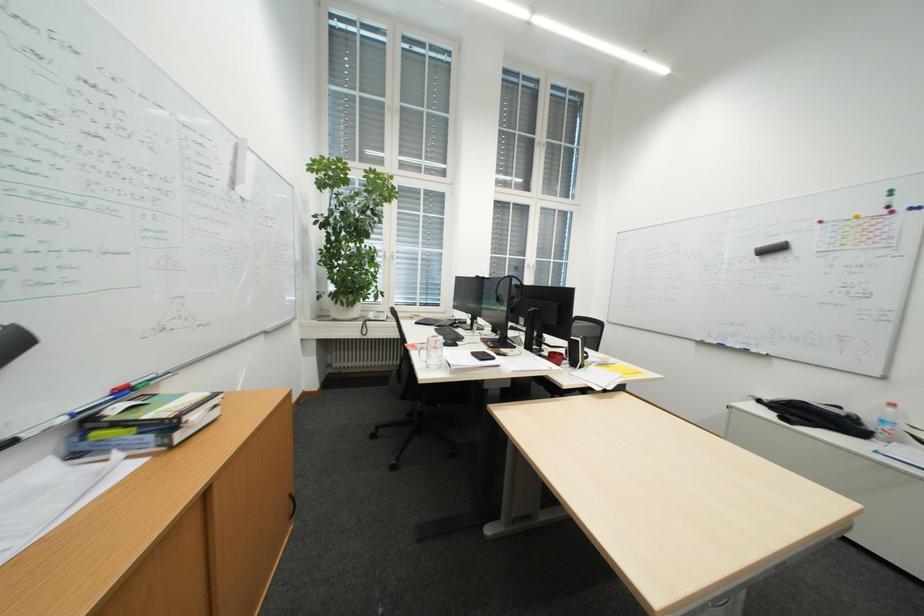
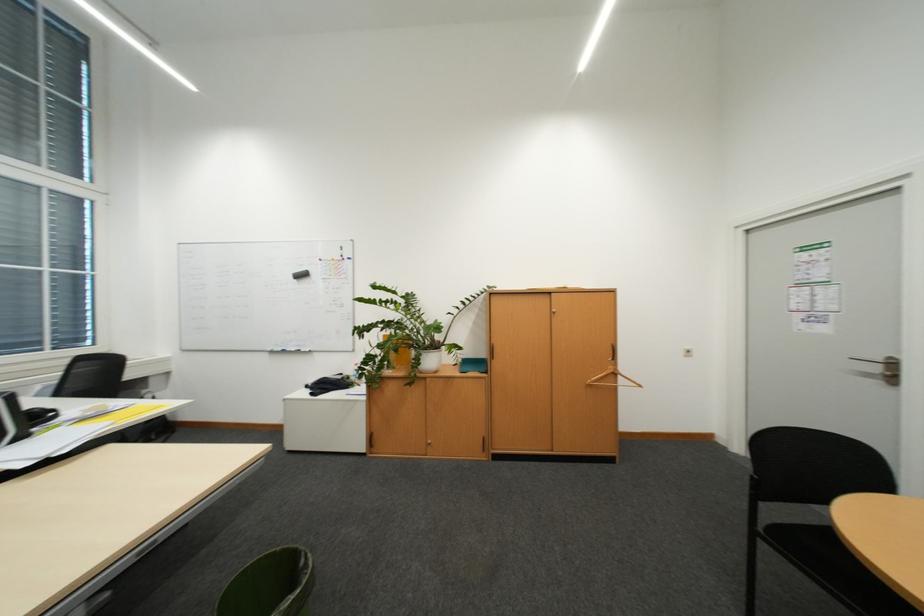
Question: The camera is either moving clockwise (left) or counter-clockwise (right) around the object. The first image is from the beginning of the video and the second image is from the end. Is the camera moving left or right when shooting the video?

Choices:
 (A) Left
 (B) Right

Answer: (A)